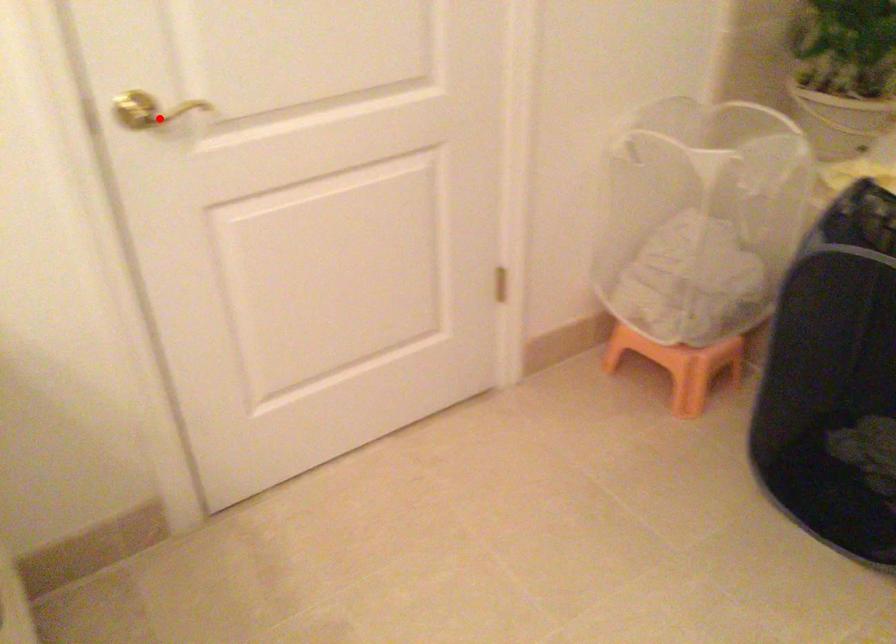
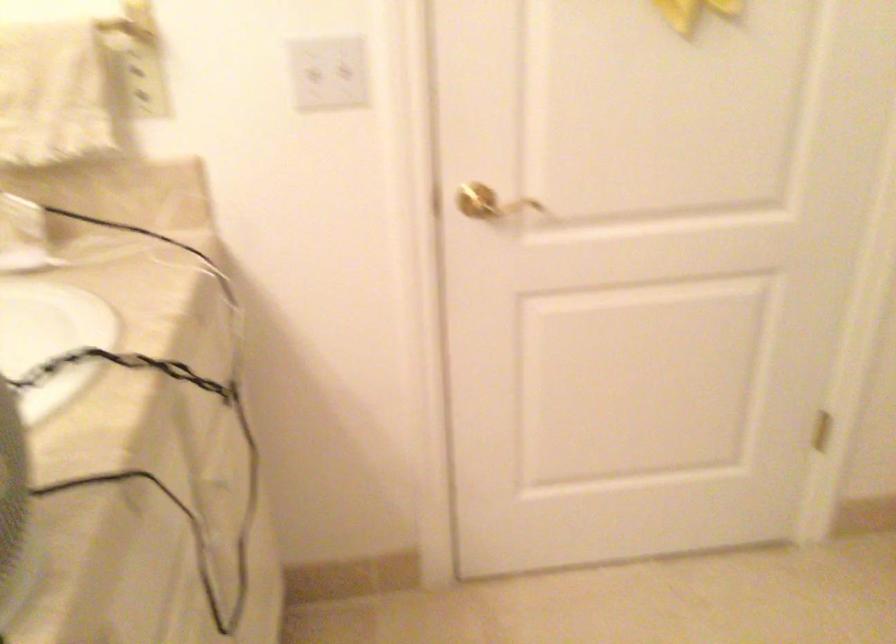
Question: I am providing you with two images of the same scene from different viewpoints. Image1 has a red point marked. In image2, the corresponding 3D location appears at what relative position? Reply with the corresponding letter.

Choices:
 (A) Closer
 (B) Farther

Answer: (B)